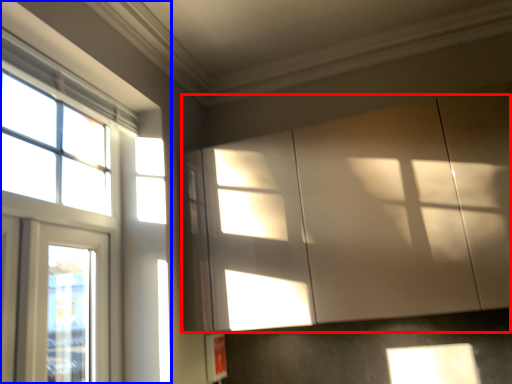
Question: Which point is closer to the camera, cabinetry (highlighted by a red box) or window (highlighted by a blue box)?

Choices:
 (A) cabinetry
 (B) window

Answer: (B)